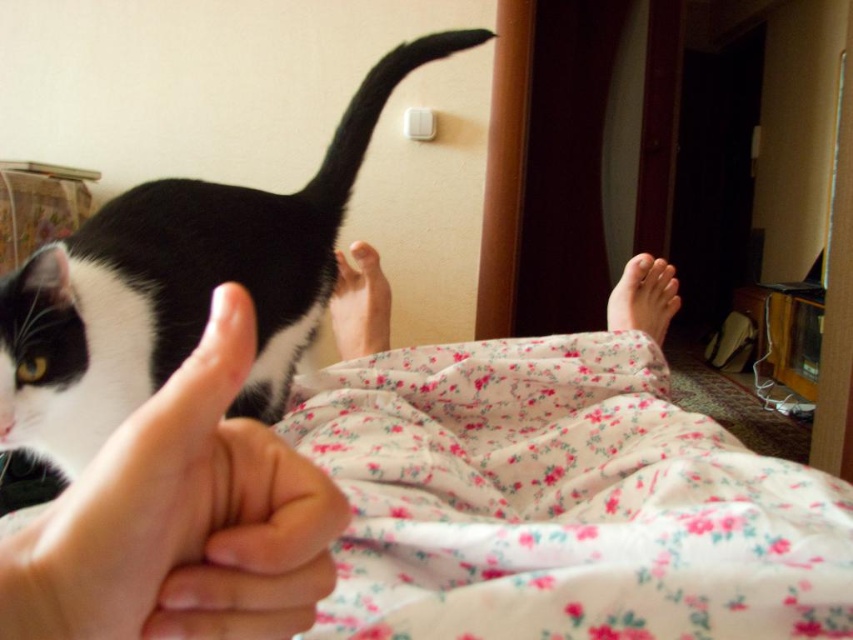
You are a robotic arm trying to pet the black and white fur cat at left. The robotic arm can reach up to 12 inches. Based on the scene, can you determine if the robotic arm can reach the cat from the white matte hand at lower left?

The distance between the black and white fur cat at left and the white matte hand at lower left is 14.05 inches. Since the robotic arm can only reach up to 12 inches, it cannot reach the cat from the white matte hand at lower left.

You are a photographer trying to capture the black and white fur cat at left and the pink floral fabric at lower right in the same frame. Based on their sizes, which object should you focus on first to ensure both are in focus?

The black and white fur cat at left is taller than the pink floral fabric at lower right, so focusing on the cat first will help ensure both are in focus since it is the larger object in the scene.

You are a photographer trying to capture the black and white fur cat at left in the center of your photo. Based on its current position at point 0.450 on the horizontal axis and 0.211 on the vertical axis, what adjustment should you make to frame the cat properly?

To center the black and white fur cat at left, adjust the camera to move the frame slightly to the right along the horizontal axis since its current position is at 0.450, which is closer to the left edge. Also, raise the frame slightly on the vertical axis as it is at 0.211, meaning it is lower than the center.